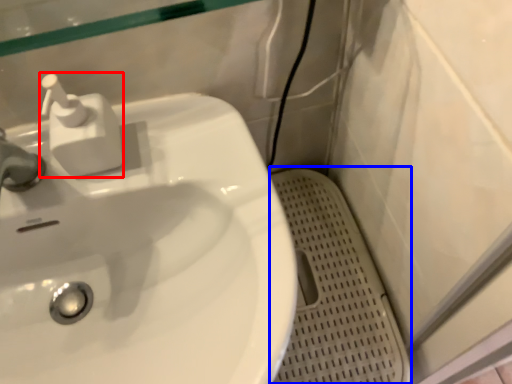
Question: Among these objects, which one is nearest to the camera, soap dispenser (highlighted by a red box) or porcelain (highlighted by a blue box)?

Choices:
 (A) soap dispenser
 (B) porcelain

Answer: (A)